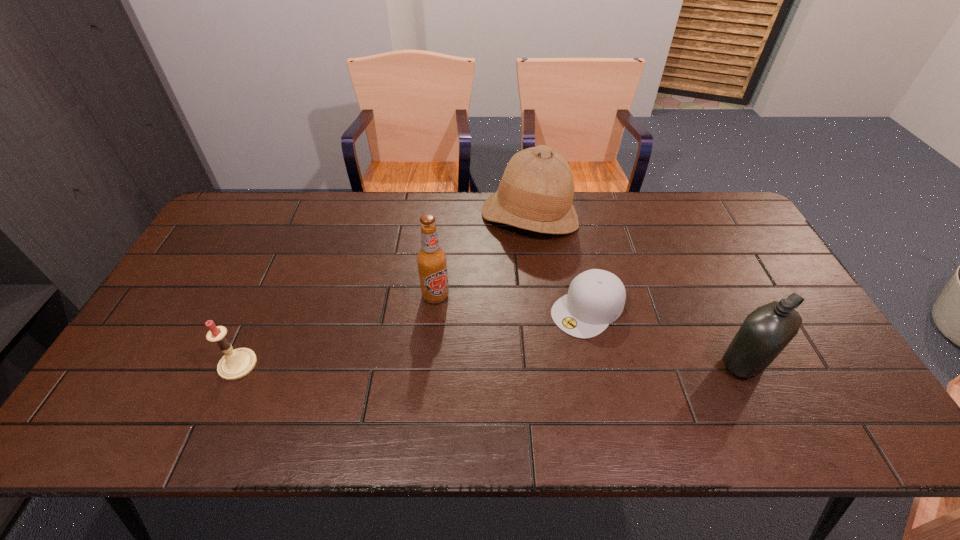
The width and height of the screenshot is (960, 540). I want to click on vacant space on the desktop that is between the candle and the bottle and is positioned on the front-facing side of the cap, so click(x=521, y=363).

Identify the location of vacant space on the desktop that is between the candle and the bottle and is positioned on the front-facing side of the hat. (441, 363).

Locate an element on the screen. The height and width of the screenshot is (540, 960). free space on the desktop that is between the fourth tallest object and the bottle and is positioned on the front label of the second object from left to right is located at coordinates (461, 363).